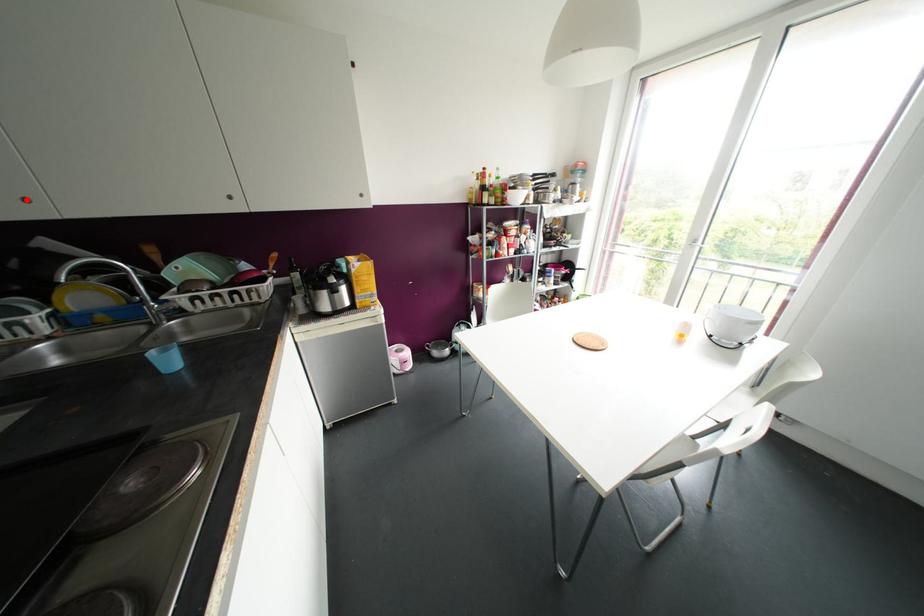
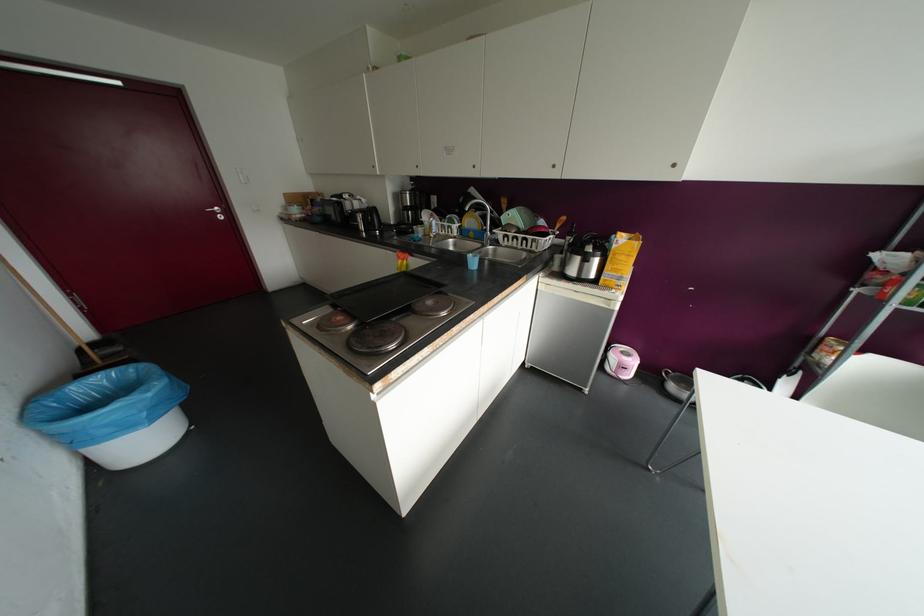
Question: I am providing you with two images of the same scene from different viewpoints. Image1 has a red point marked. In image2, the corresponding 3D location appears at what relative position? Reply with the corresponding letter.

Choices:
 (A) Closer
 (B) Farther

Answer: (A)